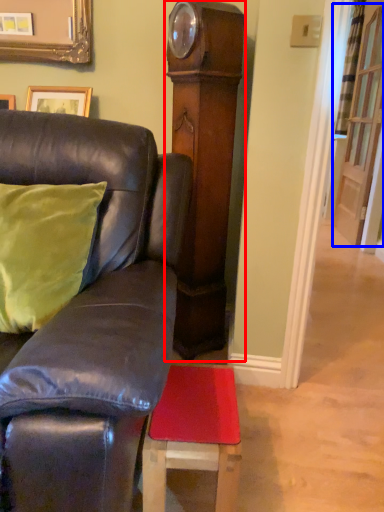
Question: Which object is closer to the camera taking this photo, side (highlighted by a red box) or glass door (highlighted by a blue box)?

Choices:
 (A) side
 (B) glass door

Answer: (A)